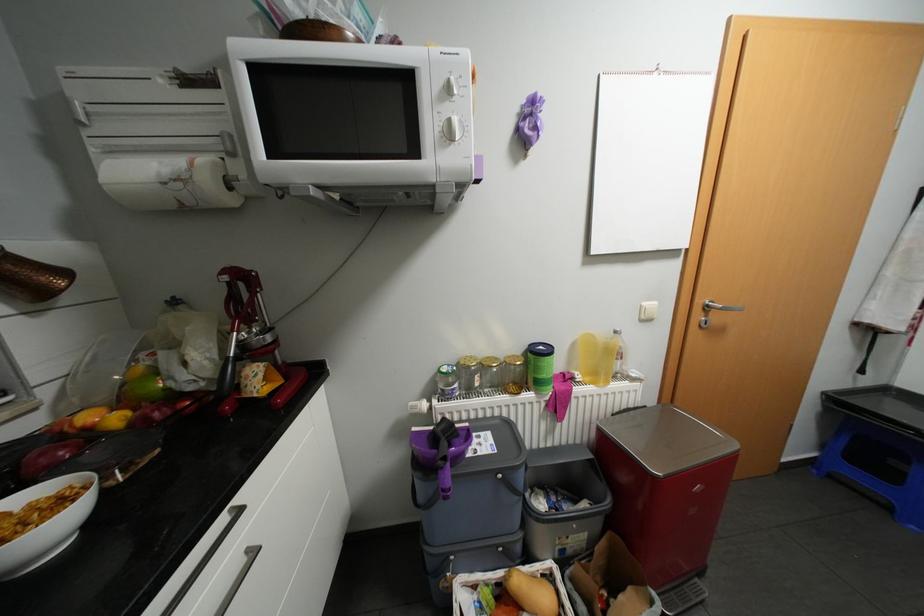
Identify the location of white light switch. Image resolution: width=924 pixels, height=616 pixels. (648, 310).